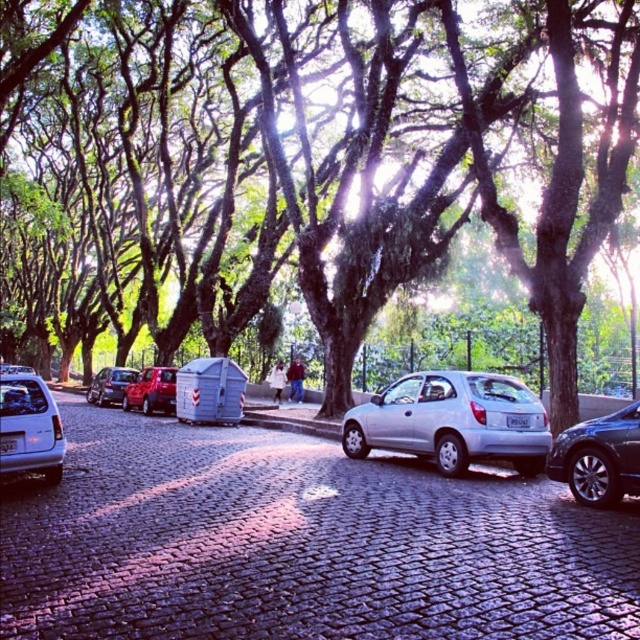
You are a pedestrian standing on the cobblestone street and want to walk from the green leafy tree at center to the silver metallic hatchback at center. Which direction should you walk?

The green leafy tree at center is to the left of the silver metallic hatchback at center, so you should walk to the right to reach it.

You are a pedestrian standing on the cobblestone street and want to avoid getting hit by falling branches. Which object should you be cautious of, the green leafy tree at center or the silver metallic car at center?

The green leafy tree at center is positioned over the silver metallic car at center, so you should be cautious of the green leafy tree at center as it could drop branches onto the street below.

You are a pedestrian standing on the cobblestone street and want to walk from the green leafy tree at center to the silver metallic car at center. Which direction should you face to move towards the car?

You should face to the right because the green leafy tree at center is to the left of the silver metallic car at center, so moving right will take you toward the car.